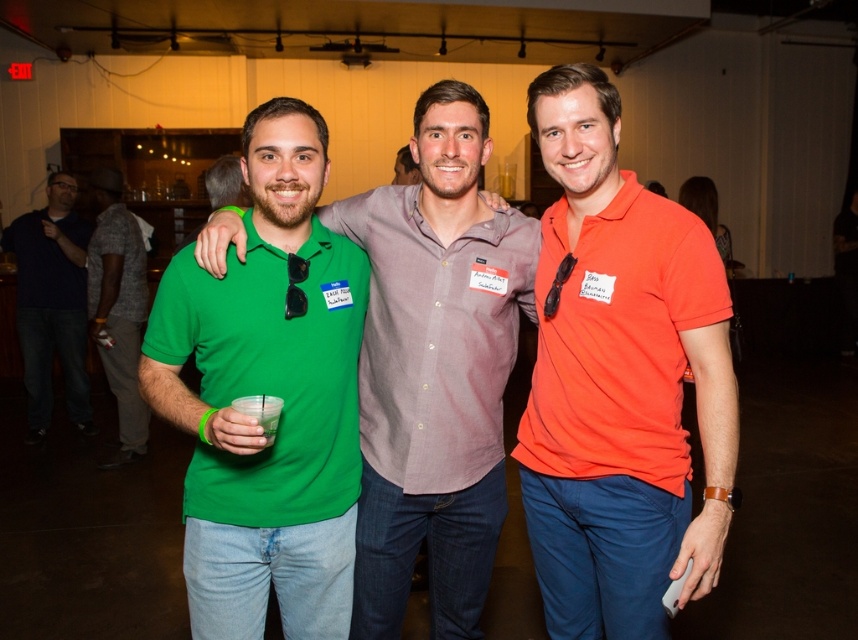
You are at a social event and want to greet the matte green polo shirt at left and the matte black shirt at left. Since you are standing in front of them, which one should you approach first to shake hands?

You should approach the matte green polo shirt at left first because it is closer to you than the matte black shirt at left.

You are organizing a photo shoot and need to arrange the matte green polo shirt at left and the green matte shirt at center so that they are both visible in the frame. Given their current positions and sizes, which one should you move closer to the camera to ensure both are fully visible?

Since the matte green polo shirt at left might be wider than the green matte shirt at center, moving the wider matte green polo shirt at left closer to the camera would help ensure both are fully visible in the frame.

You are standing at the point with coordinates point (x=252, y=416) and want to walk to the point with coordinates point (x=384, y=508). Is the destination point in front of or behind you?

The destination point with coordinates point (x=384, y=508) is behind the starting point with coordinates point (x=252, y=416), so it is behind you.